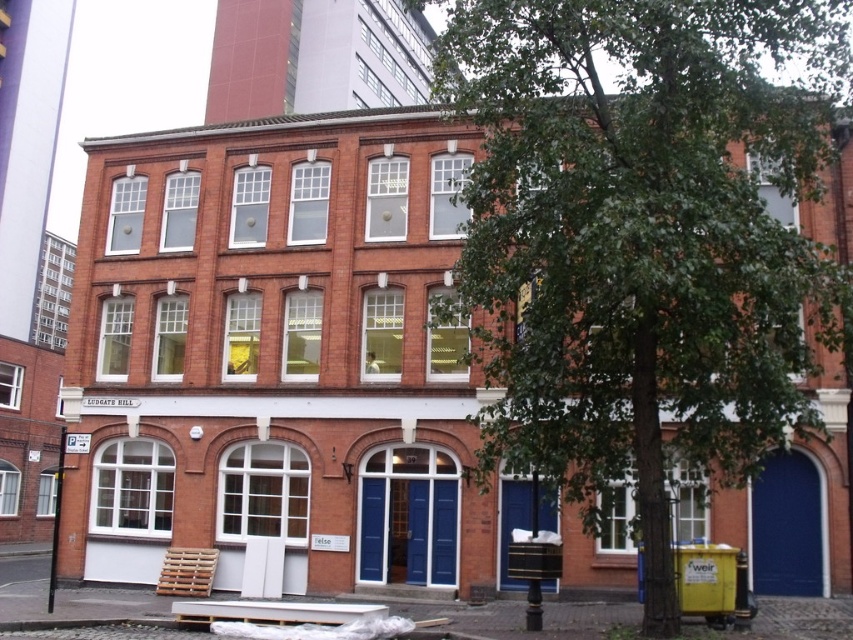
Question: Is green leafy tree at center wider than wooden pallet at lower left?

Choices:
 (A) no
 (B) yes

Answer: (B)

Question: Which point is closer to the camera?

Choices:
 (A) wooden pallet at lower left
 (B) metallic silver bench at lower center
 (C) green leafy tree at center

Answer: (C)

Question: Where is green leafy tree at center located in relation to wooden pallet at lower left in the image?

Choices:
 (A) above
 (B) below

Answer: (A)

Question: Which point is farther to the camera?

Choices:
 (A) (181, 582)
 (B) (234, 600)

Answer: (A)

Question: Which point appears closest to the camera in this image?

Choices:
 (A) (183, 586)
 (B) (646, 157)
 (C) (210, 602)

Answer: (B)

Question: Is green leafy tree at center to the left of metallic silver bench at lower center from the viewer's perspective?

Choices:
 (A) yes
 (B) no

Answer: (B)